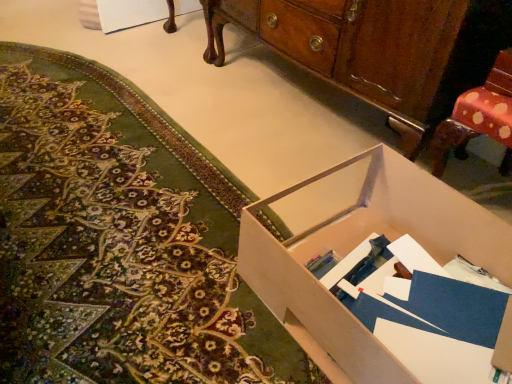
Question: Is wooden cabinet at center outside matte cardboard box at lower right?

Choices:
 (A) yes
 (B) no

Answer: (A)

Question: From the image's perspective, is wooden cabinet at center over matte cardboard box at lower right?

Choices:
 (A) no
 (B) yes

Answer: (B)

Question: Is wooden cabinet at center surrounding matte cardboard box at lower right?

Choices:
 (A) no
 (B) yes

Answer: (A)

Question: Does wooden cabinet at center have a greater width compared to matte cardboard box at lower right?

Choices:
 (A) yes
 (B) no

Answer: (B)

Question: Considering the relative positions of wooden cabinet at center and matte cardboard box at lower right in the image provided, is wooden cabinet at center in front of matte cardboard box at lower right?

Choices:
 (A) yes
 (B) no

Answer: (B)

Question: Is wooden cabinet at center bigger than matte cardboard box at lower right?

Choices:
 (A) yes
 (B) no

Answer: (A)

Question: Can you confirm if matte cardboard box at lower right is shorter than wooden cabinet at center?

Choices:
 (A) yes
 (B) no

Answer: (A)

Question: Considering the relative sizes of matte cardboard box at lower right and wooden cabinet at center in the image provided, is matte cardboard box at lower right taller than wooden cabinet at center?

Choices:
 (A) yes
 (B) no

Answer: (B)

Question: Considering the relative sizes of matte cardboard box at lower right and wooden cabinet at center in the image provided, is matte cardboard box at lower right thinner than wooden cabinet at center?

Choices:
 (A) no
 (B) yes

Answer: (A)

Question: Is matte cardboard box at lower right at the left side of wooden cabinet at center?

Choices:
 (A) yes
 (B) no

Answer: (A)

Question: From a real-world perspective, is matte cardboard box at lower right under wooden cabinet at center?

Choices:
 (A) no
 (B) yes

Answer: (B)

Question: From a real-world perspective, is matte cardboard box at lower right located higher than wooden cabinet at center?

Choices:
 (A) no
 (B) yes

Answer: (A)

Question: Considering the relative sizes of matte cardboard box at lower right and white cardboard box at center in the image provided, is matte cardboard box at lower right smaller than white cardboard box at center?

Choices:
 (A) yes
 (B) no

Answer: (B)